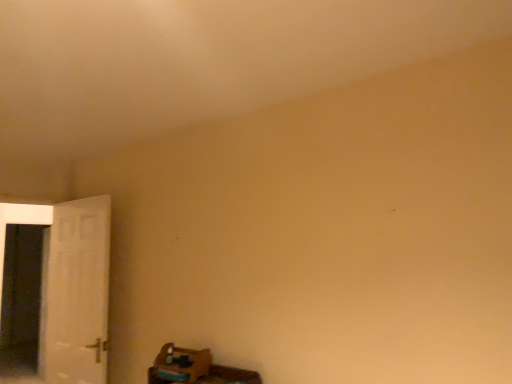
Question: Is white matte door at left not close to white glossy screen door at left?

Choices:
 (A) no
 (B) yes

Answer: (A)

Question: Can you confirm if white matte door at left is smaller than white glossy screen door at left?

Choices:
 (A) no
 (B) yes

Answer: (B)

Question: From a real-world perspective, does white matte door at left stand above white glossy screen door at left?

Choices:
 (A) yes
 (B) no

Answer: (A)

Question: Can you confirm if white matte door at left is bigger than white glossy screen door at left?

Choices:
 (A) no
 (B) yes

Answer: (A)

Question: Is white glossy screen door at left at the back of white matte door at left?

Choices:
 (A) no
 (B) yes

Answer: (A)

Question: Is the position of white matte door at left less distant than that of white glossy screen door at left?

Choices:
 (A) no
 (B) yes

Answer: (B)

Question: Is white glossy screen door at left wider than white matte door at left?

Choices:
 (A) no
 (B) yes

Answer: (B)

Question: From the image's perspective, is white glossy screen door at left beneath white matte door at left?

Choices:
 (A) no
 (B) yes

Answer: (B)

Question: Is white glossy screen door at left further to the viewer compared to white matte door at left?

Choices:
 (A) no
 (B) yes

Answer: (B)

Question: From a real-world perspective, is white glossy screen door at left located beneath white matte door at left?

Choices:
 (A) no
 (B) yes

Answer: (B)

Question: Are white glossy screen door at left and white matte door at left located far from each other?

Choices:
 (A) no
 (B) yes

Answer: (A)

Question: Is white glossy screen door at left thinner than white matte door at left?

Choices:
 (A) yes
 (B) no

Answer: (B)

Question: From a real-world perspective, is white glossy screen door at left positioned above or below white matte door at left?

Choices:
 (A) below
 (B) above

Answer: (A)